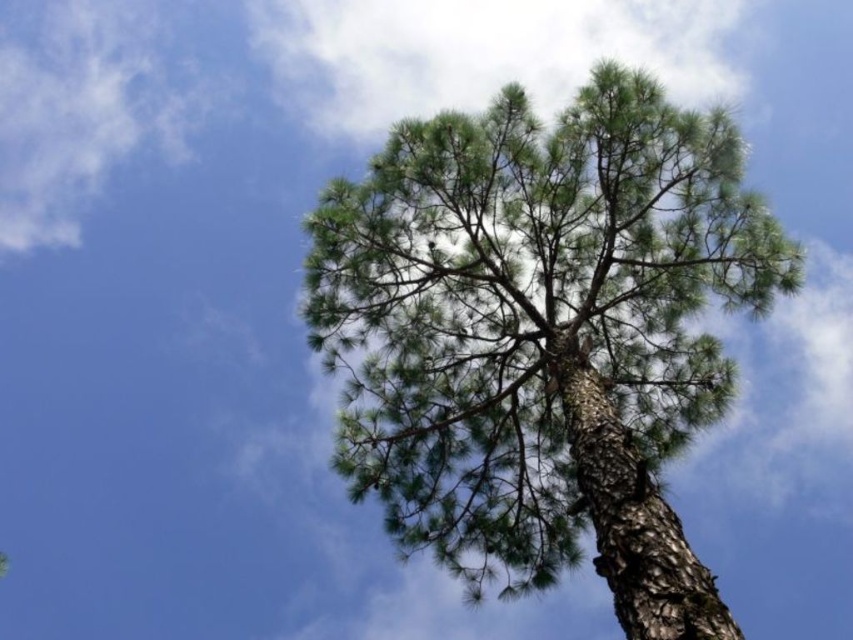
Based on the photo, you are standing at the base of the tall pine tree and looking up. There are two points marked on the tree trunk. One is at coordinate point (727, 611) and the other is at point (463, 83). Which point is closer to your eyes?

Point (727, 611) is closer to the camera than point (463, 83).

You are a bird flying near the green rough bark tree at center and the white fluffy cloud at upper center. Which object is taller?

The green rough bark tree at center is shorter than the white fluffy cloud at upper center, so the white fluffy cloud at upper center is taller.

You are a bird that can fly 10 feet per second. You are currently perched on the green rough bark tree at center and want to reach the white fluffy cloud at upper center. How many seconds will it take you to fly straight to the cloud?

The distance between the green rough bark tree at center and the white fluffy cloud at upper center is 24.20 feet. Since the bird flies at 10 feet per second, it would take approximately 2.42 seconds to reach the cloud.